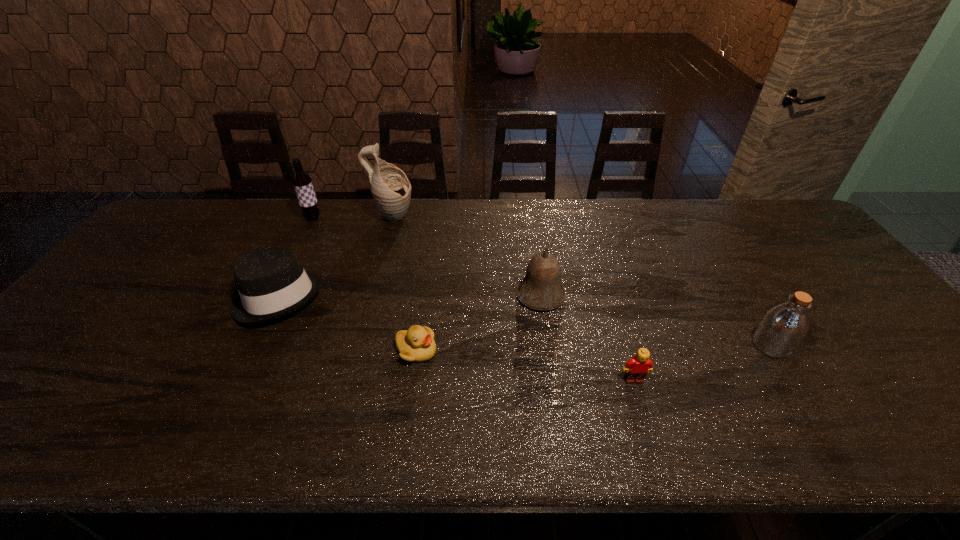
Find the location of a particular element. This screenshot has width=960, height=540. the tallest object is located at coordinates (x=390, y=187).

The image size is (960, 540). I want to click on the fifth object from right to left, so click(x=390, y=187).

Find the location of a particular element. The width and height of the screenshot is (960, 540). the second tallest object is located at coordinates (302, 182).

In order to click on bottle in this screenshot , I will do `click(784, 326)`.

The width and height of the screenshot is (960, 540). I want to click on the third object from right to left, so click(x=541, y=289).

Locate an element on the screen. Image resolution: width=960 pixels, height=540 pixels. the third shortest object is located at coordinates (271, 282).

This screenshot has height=540, width=960. Identify the location of the sixth object from left to right. (637, 368).

Identify the location of the second shortest object. This screenshot has width=960, height=540. (637, 368).

You are a GUI agent. You are given a task and a screenshot of the screen. Output one action in this format:
    pyautogui.click(x=<x>, y=<y>)
    Task: Click on the duckling
    Image resolution: width=960 pixels, height=540 pixels.
    Given the screenshot: What is the action you would take?
    click(x=416, y=344)

The width and height of the screenshot is (960, 540). I want to click on the fourth object from left to right, so click(416, 344).